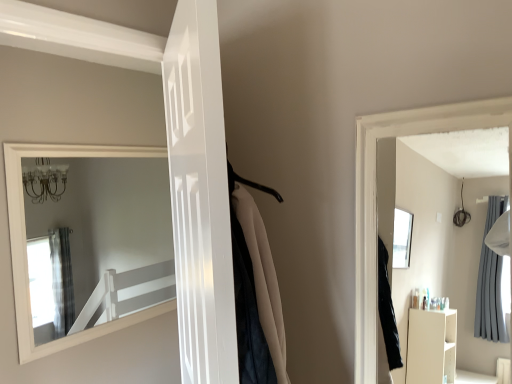
What do you see at coordinates (200, 196) in the screenshot? I see `white glossy door at center, which ranks as the 2th door in left-to-right order` at bounding box center [200, 196].

What is the approximate width of white glossy door at center, which ranks as the 2th door in left-to-right order?

white glossy door at center, which ranks as the 2th door in left-to-right order, is 6.42 inches in width.

You are a GUI agent. You are given a task and a screenshot of the screen. Output one action in this format:
    pyautogui.click(x=<x>, y=<y>)
    Task: Click on the white glossy door at center, which ranks as the 2th door in left-to-right order
    The height and width of the screenshot is (384, 512).
    Given the screenshot: What is the action you would take?
    pyautogui.click(x=200, y=196)

What are the coordinates of `white glossy door at upper left, the 1th door viewed from the left` in the screenshot? It's located at [x=111, y=359].

The width and height of the screenshot is (512, 384). Describe the element at coordinates (111, 359) in the screenshot. I see `white glossy door at upper left, the 1th door viewed from the left` at that location.

Find the location of a particular element. white glossy door at center, which ranks as the first door in right-to-left order is located at coordinates (200, 196).

Is white glossy door at center, which ranks as the first door in right-to-left order, to the left of white glossy door at upper left, the 2th door positioned from the right, from the viewer's perspective?

No.

Relative to white glossy door at upper left, the 2th door positioned from the right, is white glossy door at center, which ranks as the first door in right-to-left order, in front or behind?

Visually, white glossy door at center, which ranks as the first door in right-to-left order, is located in front of white glossy door at upper left, the 2th door positioned from the right.

Considering the positions of points (218, 73) and (108, 353), is point (218, 73) farther from camera compared to point (108, 353)?

No, it is not.

From the image's perspective, which is above, white glossy door at center, which ranks as the 2th door in left-to-right order, or white glossy door at upper left, the 1th door viewed from the left?

white glossy door at upper left, the 1th door viewed from the left, appears higher in the image.

From a real-world perspective, is white glossy door at center, which ranks as the 2th door in left-to-right order, positioned over white glossy door at upper left, the 2th door positioned from the right, based on gravity?

Incorrect, from a real-world perspective, white glossy door at center, which ranks as the 2th door in left-to-right order, is lower than white glossy door at upper left, the 2th door positioned from the right.

Considering the sizes of white glossy door at center, which ranks as the 2th door in left-to-right order, and white glossy door at upper left, the 2th door positioned from the right, in the image, is white glossy door at center, which ranks as the 2th door in left-to-right order, wider or thinner than white glossy door at upper left, the 2th door positioned from the right,?

Considering their sizes, white glossy door at center, which ranks as the 2th door in left-to-right order, looks broader than white glossy door at upper left, the 2th door positioned from the right.

Considering the relative sizes of white glossy door at center, which ranks as the 2th door in left-to-right order, and white glossy door at upper left, the 2th door positioned from the right, in the image provided, is white glossy door at center, which ranks as the 2th door in left-to-right order, shorter than white glossy door at upper left, the 2th door positioned from the right,?

Correct, white glossy door at center, which ranks as the 2th door in left-to-right order, is not as tall as white glossy door at upper left, the 2th door positioned from the right.

Can you confirm if white glossy door at center, which ranks as the 2th door in left-to-right order, is bigger than white glossy door at upper left, the 1th door viewed from the left?

Correct, white glossy door at center, which ranks as the 2th door in left-to-right order, is larger in size than white glossy door at upper left, the 1th door viewed from the left.

Is white glossy door at center, which ranks as the first door in right-to-left order, completely or partially outside of white glossy door at upper left, the 1th door viewed from the left?

Yes, white glossy door at center, which ranks as the first door in right-to-left order, is not within white glossy door at upper left, the 1th door viewed from the left.

Looking at this image, is white glossy door at center, which ranks as the first door in right-to-left order, far from white glossy door at upper left, the 2th door positioned from the right?

Yes, white glossy door at center, which ranks as the first door in right-to-left order, is far from white glossy door at upper left, the 2th door positioned from the right.

Is white glossy door at upper left, the 1th door viewed from the left, at the back of white glossy door at center, which ranks as the 2th door in left-to-right order?

Yes, white glossy door at upper left, the 1th door viewed from the left, is at the back of white glossy door at center, which ranks as the 2th door in left-to-right order.

Can you tell me how much white glossy door at center, which ranks as the first door in right-to-left order, and white glossy door at upper left, the 2th door positioned from the right, differ in facing direction?

125 degrees.

The image size is (512, 384). Find the location of `door below the white glossy door at upper left, the 1th door viewed from the left (from a real-world perspective)`. door below the white glossy door at upper left, the 1th door viewed from the left (from a real-world perspective) is located at coordinates (200, 196).

Is white glossy door at upper left, the 1th door viewed from the left, to the left of white glossy door at center, which ranks as the 2th door in left-to-right order, from the viewer's perspective?

Yes, white glossy door at upper left, the 1th door viewed from the left, is to the left of white glossy door at center, which ranks as the 2th door in left-to-right order.

Is white glossy door at upper left, the 1th door viewed from the left, positioned in front of white glossy door at center, which ranks as the first door in right-to-left order?

No.

Between point (164, 374) and point (217, 378), which one is positioned in front?

Point (217, 378)

From the image's perspective, which one is positioned lower, white glossy door at upper left, the 1th door viewed from the left, or white glossy door at center, which ranks as the first door in right-to-left order?

From the image's view, white glossy door at center, which ranks as the first door in right-to-left order, is below.

From a real-world perspective, is white glossy door at upper left, the 2th door positioned from the right, below white glossy door at center, which ranks as the first door in right-to-left order?

No.

Considering the relative sizes of white glossy door at upper left, the 2th door positioned from the right, and white glossy door at center, which ranks as the 2th door in left-to-right order, in the image provided, is white glossy door at upper left, the 2th door positioned from the right, thinner than white glossy door at center, which ranks as the 2th door in left-to-right order,?

Yes, white glossy door at upper left, the 2th door positioned from the right, is thinner than white glossy door at center, which ranks as the 2th door in left-to-right order.

Considering the sizes of white glossy door at upper left, the 2th door positioned from the right, and white glossy door at center, which ranks as the 2th door in left-to-right order, in the image, is white glossy door at upper left, the 2th door positioned from the right, taller or shorter than white glossy door at center, which ranks as the 2th door in left-to-right order,?

In the image, white glossy door at upper left, the 2th door positioned from the right, appears to be taller than white glossy door at center, which ranks as the 2th door in left-to-right order.

Considering the relative sizes of white glossy door at upper left, the 2th door positioned from the right, and white glossy door at center, which ranks as the 2th door in left-to-right order, in the image provided, is white glossy door at upper left, the 2th door positioned from the right, bigger than white glossy door at center, which ranks as the 2th door in left-to-right order,?

No.

Consider the image. Is white glossy door at upper left, the 2th door positioned from the right, completely or partially outside of white glossy door at center, which ranks as the first door in right-to-left order?

Yes, white glossy door at upper left, the 2th door positioned from the right, is located beyond the bounds of white glossy door at center, which ranks as the first door in right-to-left order.

Is white glossy door at upper left, the 1th door viewed from the left, next to white glossy door at center, which ranks as the 2th door in left-to-right order, and touching it?

No.

Is white glossy door at upper left, the 1th door viewed from the left, oriented away from white glossy door at center, which ranks as the 2th door in left-to-right order?

That's right, white glossy door at upper left, the 1th door viewed from the left, is facing away from white glossy door at center, which ranks as the 2th door in left-to-right order.

How different are the orientations of white glossy door at upper left, the 1th door viewed from the left, and white glossy door at center, which ranks as the first door in right-to-left order, in degrees?

The angular difference between white glossy door at upper left, the 1th door viewed from the left, and white glossy door at center, which ranks as the first door in right-to-left order, is 125 degrees.

You are a GUI agent. You are given a task and a screenshot of the screen. Output one action in this format:
    pyautogui.click(x=<x>, y=<y>)
    Task: Click on the door that is on the left side of white glossy door at center, which ranks as the 2th door in left-to-right order
    This screenshot has height=384, width=512.
    Given the screenshot: What is the action you would take?
    pyautogui.click(x=111, y=359)

The height and width of the screenshot is (384, 512). In the image, there is a white glossy door at upper left, the 1th door viewed from the left. In order to click on door below it (from a real-world perspective) in this screenshot , I will do `click(200, 196)`.

Locate an element on the screen. This screenshot has height=384, width=512. door below the white glossy door at upper left, the 2th door positioned from the right (from the image's perspective) is located at coordinates (200, 196).